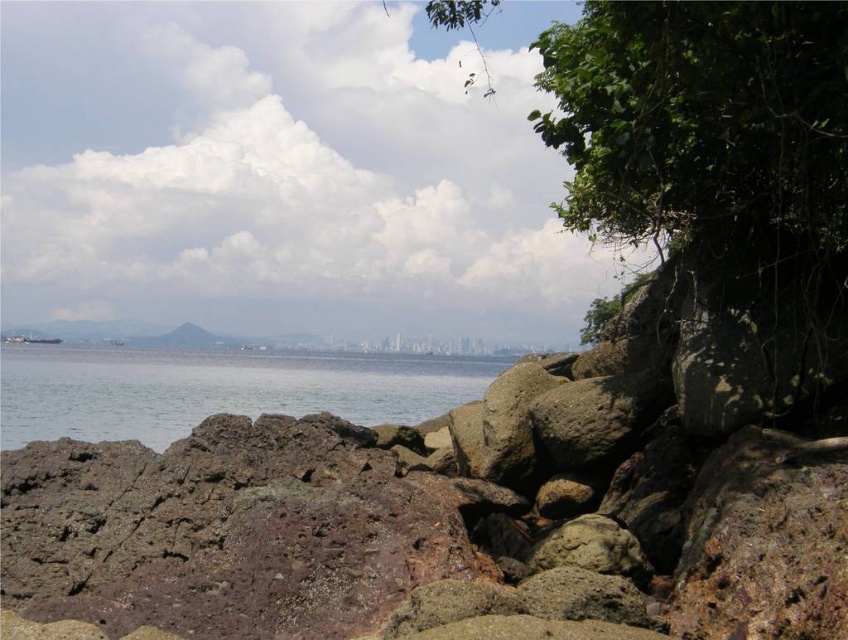
Question: Among these objects, which one is farthest from the camera?

Choices:
 (A) clear water at center
 (B) brown rough rocks at center

Answer: (A)

Question: Which object is farther from the camera taking this photo?

Choices:
 (A) brown rough rocks at center
 (B) clear water at center

Answer: (B)

Question: Observing the image, what is the correct spatial positioning of brown rough rocks at center in reference to clear water at center?

Choices:
 (A) below
 (B) above

Answer: (B)

Question: Does brown rough rocks at center appear on the right side of clear water at center?

Choices:
 (A) no
 (B) yes

Answer: (B)

Question: From the image, what is the correct spatial relationship of brown rough rocks at center in relation to clear water at center?

Choices:
 (A) below
 (B) above

Answer: (B)